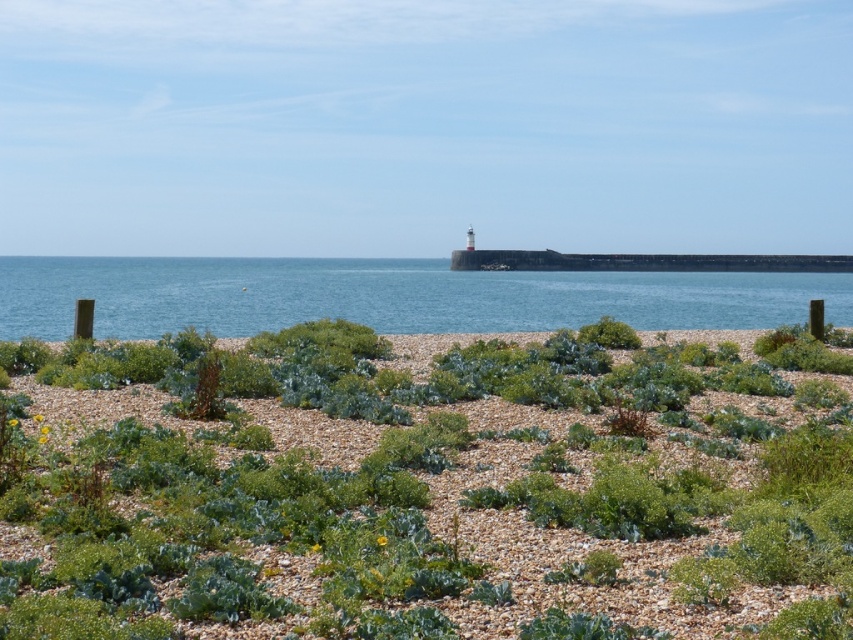
Question: Does green leafy plant at center appear on the right side of blue water at center?

Choices:
 (A) yes
 (B) no

Answer: (B)

Question: Is green leafy plant at center above blue water at center?

Choices:
 (A) yes
 (B) no

Answer: (B)

Question: Which of the following is the farthest from the observer?

Choices:
 (A) (548, 310)
 (B) (723, 406)

Answer: (A)

Question: Does green leafy plant at center come behind blue water at center?

Choices:
 (A) no
 (B) yes

Answer: (A)